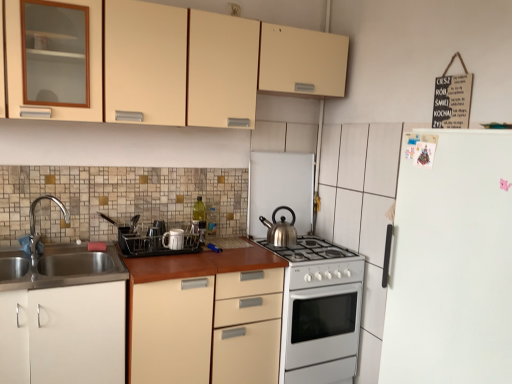
Question: From a real-world perspective, is matte plastic dish rack at center, which is the first appliance in left-to-right order, positioned over matte beige cabinet at upper center, which appears as the 1th cabinetry when viewed from the top, based on gravity?

Choices:
 (A) yes
 (B) no

Answer: (B)

Question: Is the depth of matte plastic dish rack at center, the 1th appliance from the front, greater than that of matte beige cabinet at upper center, which appears as the 1th cabinetry when viewed from the top?

Choices:
 (A) no
 (B) yes

Answer: (B)

Question: Can you see matte plastic dish rack at center, which is the 3th appliance in right-to-left order, touching matte beige cabinet at upper center, which is the 2th cabinetry in bottom-to-top order?

Choices:
 (A) yes
 (B) no

Answer: (B)

Question: Is matte plastic dish rack at center, which ranks as the third appliance in back-to-front order, to the left of matte beige cabinet at upper center, which is the 2th cabinetry in bottom-to-top order, from the viewer's perspective?

Choices:
 (A) yes
 (B) no

Answer: (A)

Question: Considering the relative sizes of matte plastic dish rack at center, which is the 3th appliance in right-to-left order, and matte beige cabinet at upper center, which is the 2th cabinetry in bottom-to-top order, in the image provided, is matte plastic dish rack at center, which is the 3th appliance in right-to-left order, wider than matte beige cabinet at upper center, which is the 2th cabinetry in bottom-to-top order,?

Choices:
 (A) yes
 (B) no

Answer: (B)

Question: From a real-world perspective, is brown laminate countertop at center physically located above or below white matte cabinet at lower left, arranged as the second cabinetry when viewed from the top?

Choices:
 (A) below
 (B) above

Answer: (A)

Question: Relative to white matte cabinet at lower left, the first cabinetry from the bottom, is brown laminate countertop at center in front or behind?

Choices:
 (A) behind
 (B) front

Answer: (A)

Question: In terms of height, does brown laminate countertop at center look taller or shorter compared to white matte cabinet at lower left, the first cabinetry from the bottom?

Choices:
 (A) short
 (B) tall

Answer: (B)

Question: Is brown laminate countertop at center bigger or smaller than white matte cabinet at lower left, arranged as the second cabinetry when viewed from the top?

Choices:
 (A) small
 (B) big

Answer: (B)

Question: From their relative heights in the image, would you say matte plastic dish rack at center, which is the 3th appliance in right-to-left order, is taller or shorter than white matte refrigerator at right?

Choices:
 (A) short
 (B) tall

Answer: (A)

Question: Does point (157, 231) appear closer or farther from the camera than point (439, 365)?

Choices:
 (A) closer
 (B) farther

Answer: (B)

Question: Considering their positions, is matte plastic dish rack at center, which is the first appliance in left-to-right order, located in front of or behind white matte refrigerator at right?

Choices:
 (A) front
 (B) behind

Answer: (B)

Question: Considering the positions of matte plastic dish rack at center, the 1th appliance from the front, and white matte refrigerator at right in the image, is matte plastic dish rack at center, the 1th appliance from the front, wider or thinner than white matte refrigerator at right?

Choices:
 (A) wide
 (B) thin

Answer: (B)

Question: Relative to matte plastic dish rack at center, the 1th appliance from the front, is brown laminate countertop at center in front or behind?

Choices:
 (A) front
 (B) behind

Answer: (A)

Question: In terms of width, does brown laminate countertop at center look wider or thinner when compared to matte plastic dish rack at center, which is the 3th appliance in right-to-left order?

Choices:
 (A) thin
 (B) wide

Answer: (B)